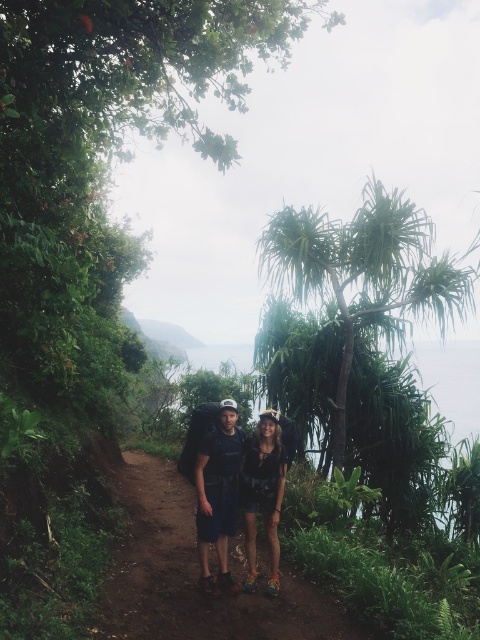
Question: Can you confirm if green leafy tree at center is bigger than matte black backpack at center?

Choices:
 (A) yes
 (B) no

Answer: (A)

Question: Among these points, which one is nearest to the camera?

Choices:
 (A) (280, 454)
 (B) (344, 307)
 (C) (151, 604)

Answer: (C)

Question: Does dirt path at center appear on the right side of green leafy tree at center?

Choices:
 (A) no
 (B) yes

Answer: (A)

Question: Among these objects, which one is farthest from the camera?

Choices:
 (A) dirt path at center
 (B) matte black shorts at center
 (C) matte black backpack at center

Answer: (B)

Question: Estimate the real-world distances between objects in this image. Which object is closer to the matte black backpack at center?

Choices:
 (A) matte black shorts at center
 (B) dirt path at center

Answer: (A)

Question: Is green leafy tree at center in front of matte black shorts at center?

Choices:
 (A) no
 (B) yes

Answer: (A)